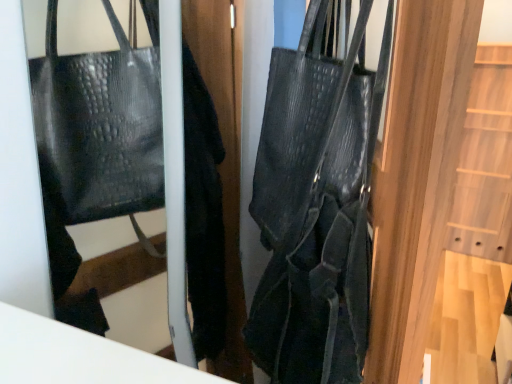
Question: From their relative heights in the image, would you say black leather coat at center is taller or shorter than black textured handbag at center?

Choices:
 (A) short
 (B) tall

Answer: (B)

Question: Based on their positions, is black leather coat at center located to the left or right of black textured handbag at center?

Choices:
 (A) right
 (B) left

Answer: (B)

Question: Does point (232, 61) appear closer or farther from the camera than point (291, 122)?

Choices:
 (A) closer
 (B) farther

Answer: (B)

Question: From a real-world perspective, is black textured handbag at center positioned above or below black leather coat at center?

Choices:
 (A) above
 (B) below

Answer: (A)

Question: Looking at the image, does black textured handbag at center seem bigger or smaller compared to black leather coat at center?

Choices:
 (A) big
 (B) small

Answer: (A)

Question: Considering the positions of point (309, 221) and point (232, 13), is point (309, 221) closer or farther from the camera than point (232, 13)?

Choices:
 (A) closer
 (B) farther

Answer: (A)

Question: Would you say black textured handbag at center is to the left or to the right of black leather coat at center in the picture?

Choices:
 (A) left
 (B) right

Answer: (B)